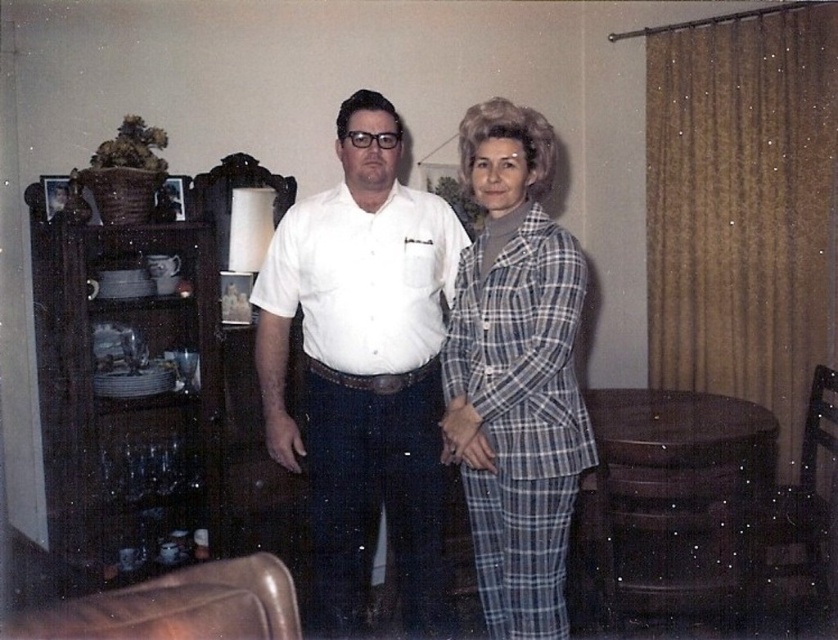
Question: Which point is farther to the camera?

Choices:
 (A) plaid fabric suit at center
 (B) white cotton shirt at center

Answer: (B)

Question: Which of the following is the farthest from the observer?

Choices:
 (A) plaid fabric suit at center
 (B) white cotton shirt at center

Answer: (B)

Question: Does white cotton shirt at center appear on the right side of plaid fabric suit at center?

Choices:
 (A) no
 (B) yes

Answer: (A)

Question: Does white cotton shirt at center have a lesser width compared to plaid fabric suit at center?

Choices:
 (A) no
 (B) yes

Answer: (A)

Question: Can you confirm if white cotton shirt at center is bigger than plaid fabric suit at center?

Choices:
 (A) no
 (B) yes

Answer: (B)